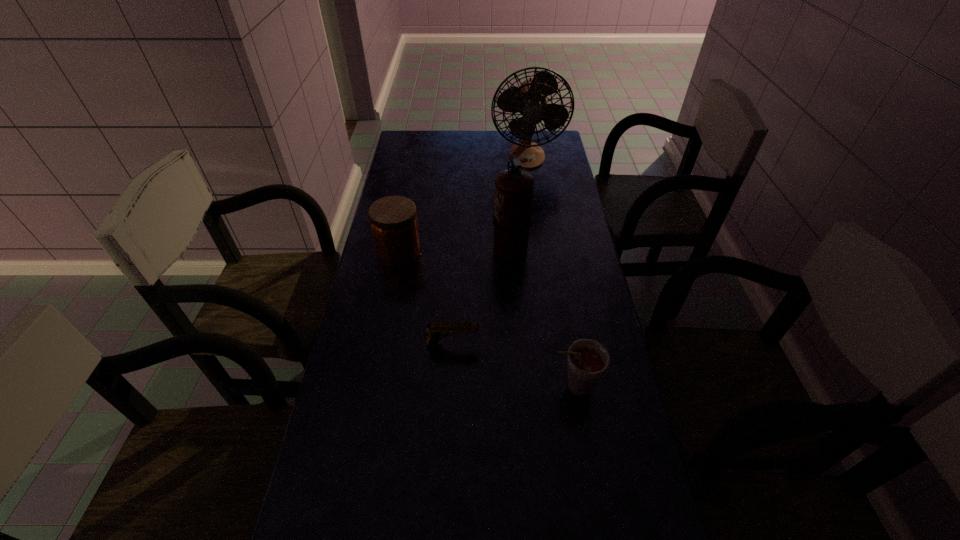
You are a GUI agent. You are given a task and a screenshot of the screen. Output one action in this format:
    pyautogui.click(x=<x>, y=<y>)
    Task: Click on the blank area at the left edge
    This screenshot has height=540, width=960.
    Given the screenshot: What is the action you would take?
    pyautogui.click(x=410, y=166)

In the image, there is a desktop. At what (x,y) coordinates should I click in order to perform the action: click on vacant region at the right edge. Please return your answer as a coordinate pair (x, y). Looking at the image, I should click on 586,450.

In the image, there is a desktop. Identify the location of vacant space at the far left corner. Image resolution: width=960 pixels, height=540 pixels. (395, 157).

The height and width of the screenshot is (540, 960). I want to click on free spot between the leftmost object and the shortest object, so click(x=426, y=298).

At what (x,y) coordinates should I click in order to perform the action: click on empty space between the fire extinguisher and the nearest object. Please return your answer as a coordinate pair (x, y). The width and height of the screenshot is (960, 540). Looking at the image, I should click on (542, 317).

Find the location of a particular element. free space between the jar and the root beer is located at coordinates (487, 319).

Where is `vacant area between the leftmost object and the root beer`? This screenshot has height=540, width=960. vacant area between the leftmost object and the root beer is located at coordinates (487, 319).

Identify the location of vacant region between the root beer and the fire extinguisher. This screenshot has width=960, height=540. 542,317.

This screenshot has width=960, height=540. I want to click on vacant point located between the jar and the fire extinguisher, so click(x=455, y=249).

Identify the location of blank region between the leftmost object and the fire extinguisher. The height and width of the screenshot is (540, 960). (455, 249).